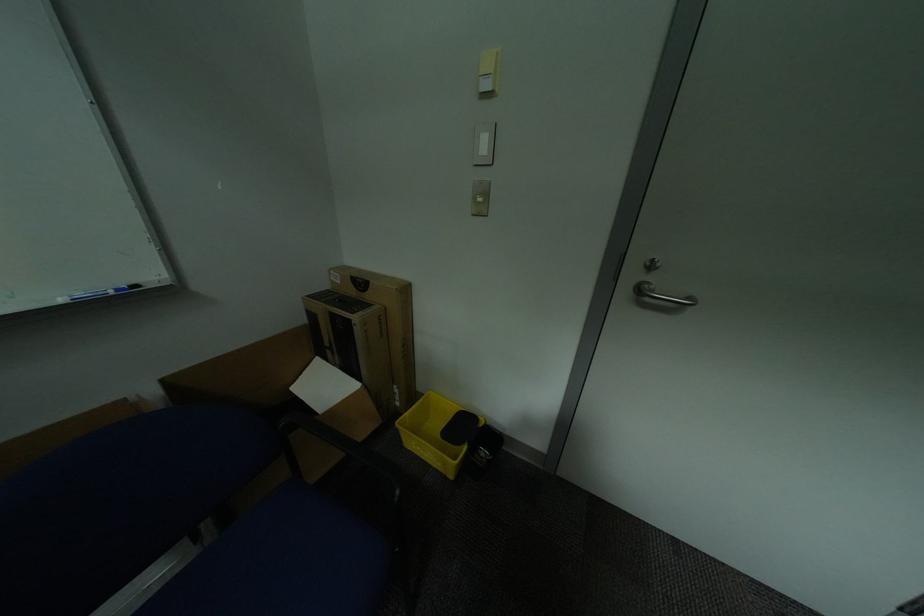
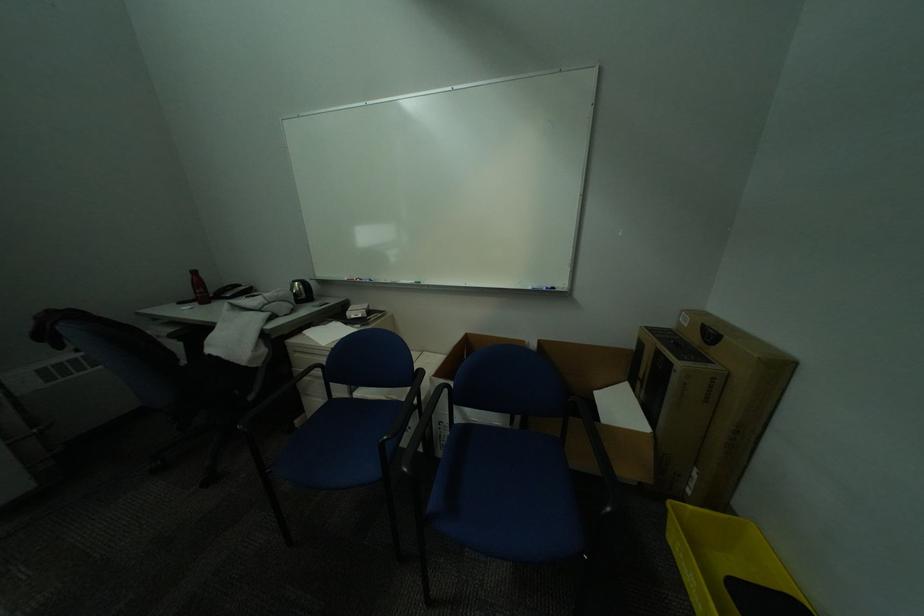
The point at (73, 302) is marked in the first image. Where is the corresponding point in the second image?

(541, 289)